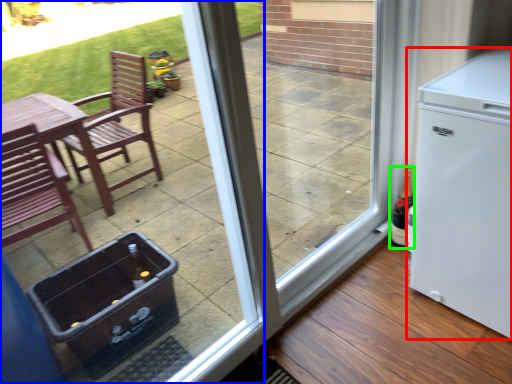
Question: Which is nearer to the refrigerator (highlighted by a red box)? door (highlighted by a blue box) or bottle (highlighted by a green box).

Choices:
 (A) door
 (B) bottle

Answer: (B)